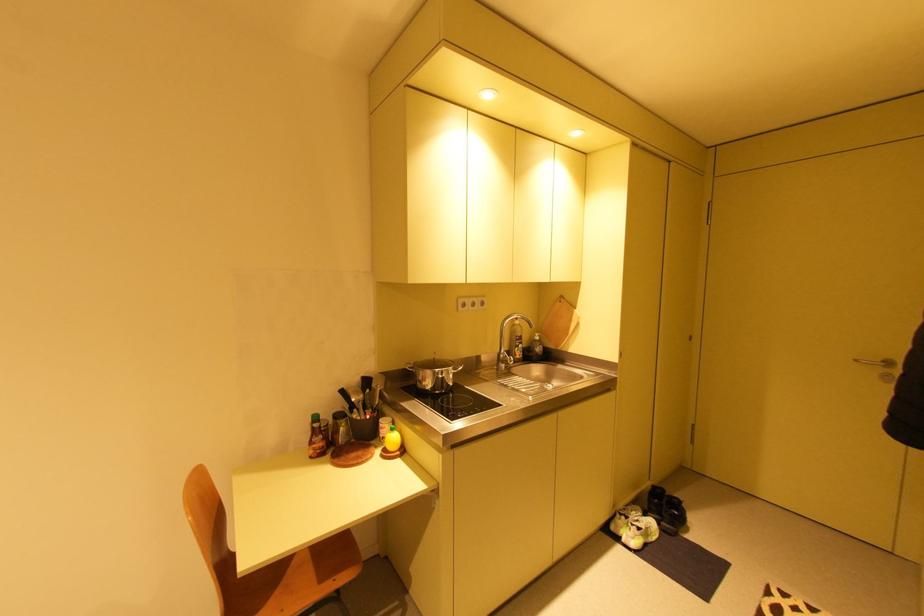
Image resolution: width=924 pixels, height=616 pixels. What are the coordinates of `soap dispenser pump` in the screenshot? It's located at (536, 347).